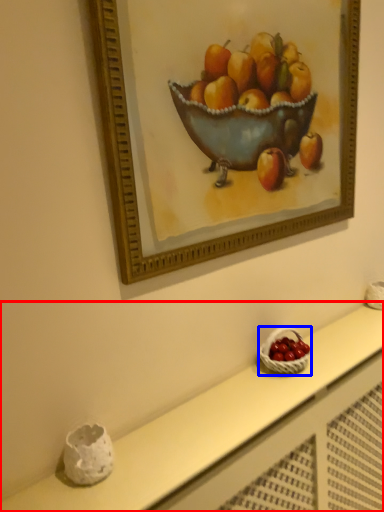
Question: Among these objects, which one is farthest to the camera, table (highlighted by a red box) or basket (highlighted by a blue box)?

Choices:
 (A) table
 (B) basket

Answer: (B)